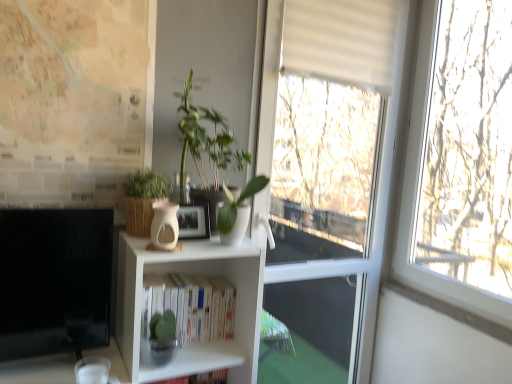
Question: Is white matte bookshelf at center positioned with its back to white glossy vase at center, which is the second plant in left-to-right order?

Choices:
 (A) no
 (B) yes

Answer: (A)

Question: From the image's perspective, does white matte bookshelf at center appear higher than white glossy vase at center, which is the first plant from right to left?

Choices:
 (A) yes
 (B) no

Answer: (B)

Question: Is white matte bookshelf at center next to white glossy vase at center, which is the second plant in left-to-right order?

Choices:
 (A) no
 (B) yes

Answer: (A)

Question: From a real-world perspective, does white matte bookshelf at center sit lower than white glossy vase at center, which is the second plant in left-to-right order?

Choices:
 (A) no
 (B) yes

Answer: (B)

Question: Does white matte bookshelf at center contain white glossy vase at center, which is the second plant in left-to-right order?

Choices:
 (A) yes
 (B) no

Answer: (B)

Question: Is white matte bookshelf at center in front of white glossy vase at center, which is the first plant from right to left?

Choices:
 (A) yes
 (B) no

Answer: (B)

Question: Is brown woven basket at center, placed as the 1th houseplant when sorted from left to right, closer to the viewer compared to matte beige vase at center?

Choices:
 (A) no
 (B) yes

Answer: (A)

Question: From the image's perspective, is brown woven basket at center, marked as the 2th houseplant in a right-to-left arrangement, on top of matte beige vase at center?

Choices:
 (A) yes
 (B) no

Answer: (A)

Question: Is matte beige vase at center surrounded by brown woven basket at center, marked as the 2th houseplant in a right-to-left arrangement?

Choices:
 (A) yes
 (B) no

Answer: (B)

Question: Are brown woven basket at center, marked as the 2th houseplant in a right-to-left arrangement, and matte beige vase at center located far from each other?

Choices:
 (A) no
 (B) yes

Answer: (A)

Question: Can you confirm if brown woven basket at center, marked as the 2th houseplant in a right-to-left arrangement, is wider than matte beige vase at center?

Choices:
 (A) yes
 (B) no

Answer: (A)

Question: From a real-world perspective, is brown woven basket at center, placed as the 1th houseplant when sorted from left to right, positioned over matte beige vase at center based on gravity?

Choices:
 (A) no
 (B) yes

Answer: (B)

Question: From the image's perspective, is brown woven basket at center, marked as the 2th houseplant in a right-to-left arrangement, located above white matte bookshelf at center?

Choices:
 (A) yes
 (B) no

Answer: (A)